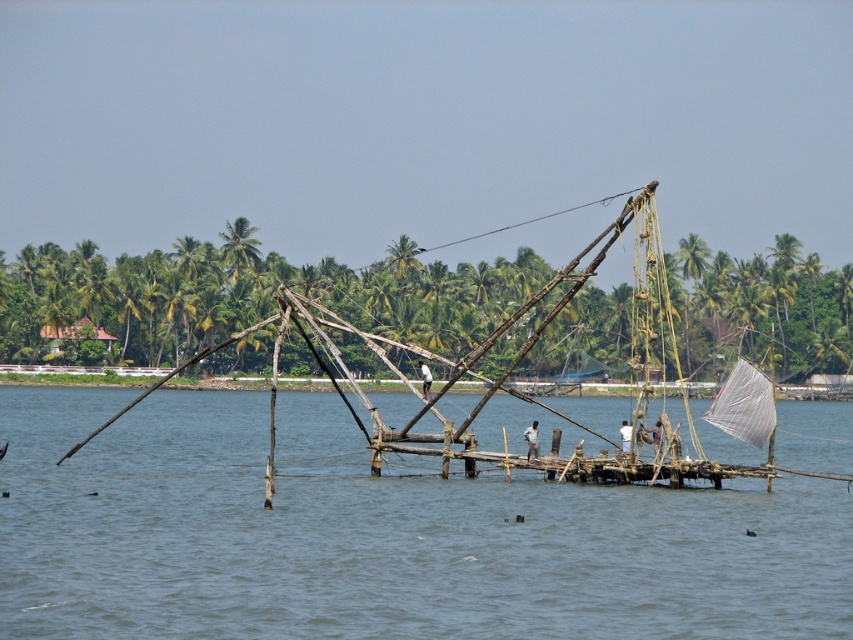
Question: Is transparent water at center to the right of light brown wooden pole at center from the viewer's perspective?

Choices:
 (A) yes
 (B) no

Answer: (B)

Question: Is wooden boat at center smaller than light brown wooden pole at center?

Choices:
 (A) yes
 (B) no

Answer: (B)

Question: Is wooden boat at center closer to camera compared to light brown wooden pole at center?

Choices:
 (A) no
 (B) yes

Answer: (B)

Question: Which point appears closest to the camera in this image?

Choices:
 (A) (26, 529)
 (B) (426, 381)
 (C) (589, 264)

Answer: (A)

Question: Which point is farther to the camera?

Choices:
 (A) transparent water at center
 (B) light brown wooden pole at center
 (C) wooden boat at center

Answer: (B)

Question: Which object is positioned farthest from the light brown wooden pole at center?

Choices:
 (A) transparent water at center
 (B) wooden boat at center

Answer: (A)